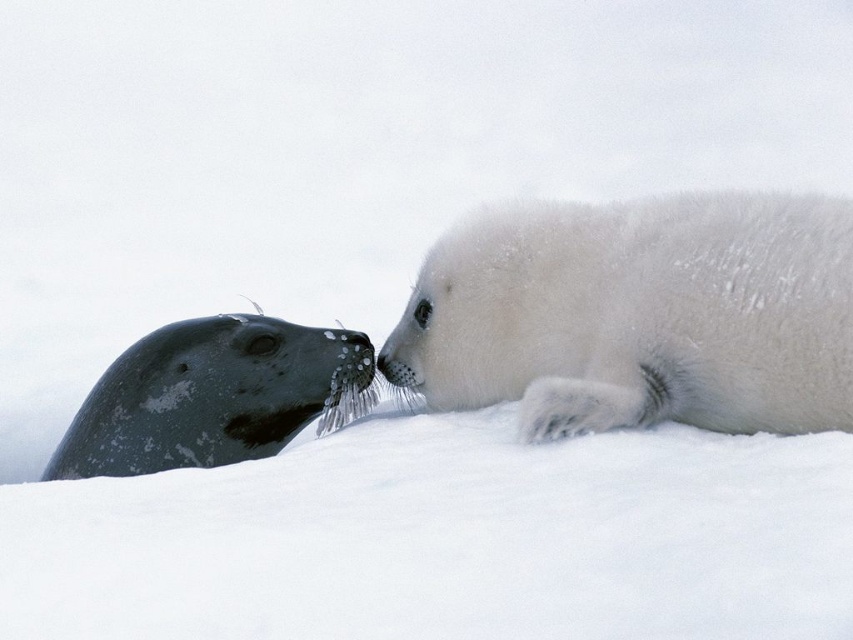
You are standing at the center of the snowy area in the image. You see a white fluffy seal at right and a darker gray seal on the left. If you want to reach the point marked at coordinates point [637,316], which seal should you approach?

The point [637,316] is located on the white fluffy seal at right, so you should approach the white fluffy seal at right.

You are a wildlife photographer observing the seals. You want to capture a photo where the white fluffy seal at right is clearly visible without being blocked by the gray textured seal at left. Based on their positions, is this possible?

The white fluffy seal at right is in front of the gray textured seal at left, so it is already positioned where it won